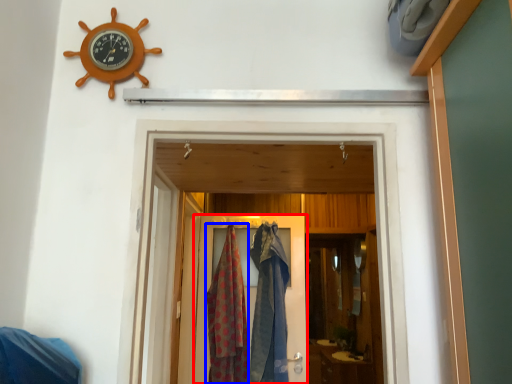
Question: Which object is further to the camera taking this photo, door (highlighted by a red box) or clothing (highlighted by a blue box)?

Choices:
 (A) door
 (B) clothing

Answer: (A)